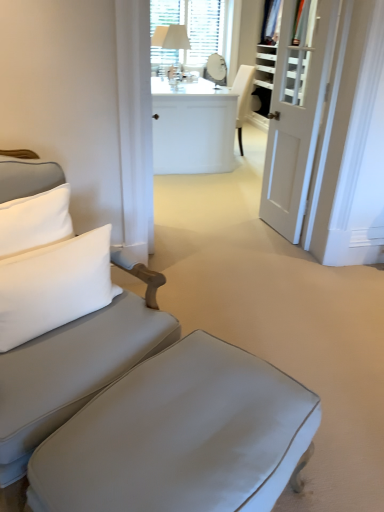
Question: Considering their positions, is white glossy desk at center located in front of or behind matte gray fabric couch at left?

Choices:
 (A) front
 (B) behind

Answer: (B)

Question: Is point (167, 147) closer or farther from the camera than point (26, 378)?

Choices:
 (A) closer
 (B) farther

Answer: (B)

Question: Estimate the real-world distances between objects in this image. Which object is closer to the white soft pillow at left?

Choices:
 (A) matte gray ottoman at lower center
 (B) white glossy desk at center
 (C) white glossy door at right
 (D) white fabric table lamp at upper center
 (E) matte gray fabric couch at left

Answer: (E)

Question: Which is farther from the white fabric table lamp at upper center?

Choices:
 (A) matte gray fabric couch at left
 (B) matte gray ottoman at lower center
 (C) white glossy desk at center
 (D) white soft pillow at left
 (E) white glossy door at right

Answer: (B)